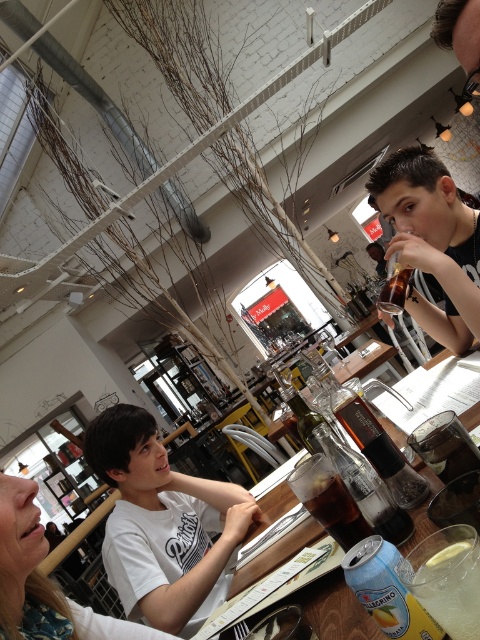
Question: Which of the following is the farthest from the observer?

Choices:
 (A) clear glass bottle at center
 (B) white cotton t-shirt at center

Answer: (B)

Question: Which object is positioned closest to the clear plastic cup at center?

Choices:
 (A) white cotton t-shirt at center
 (B) black matte shirt at upper right
 (C) translucent glass bottle at center
 (D) translucent glass bottle at upper right

Answer: (C)

Question: Is white cotton t-shirt at center to the right of black matte shirt at upper right from the viewer's perspective?

Choices:
 (A) no
 (B) yes

Answer: (A)

Question: Is black matte shirt at upper right to the right of translucent glass bottle at center from the viewer's perspective?

Choices:
 (A) no
 (B) yes

Answer: (B)

Question: Which point is closer to the camera?

Choices:
 (A) (352, 456)
 (B) (348, 412)

Answer: (A)

Question: Is white cotton shirt at center above translucent glass bottle at upper right?

Choices:
 (A) no
 (B) yes

Answer: (A)